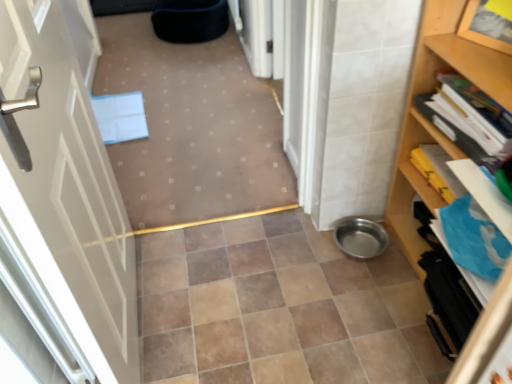
Question: Is brown ceramic tile at center wider than matte blue folder at center?

Choices:
 (A) no
 (B) yes

Answer: (B)

Question: Is matte blue folder at center surrounded by brown ceramic tile at center?

Choices:
 (A) no
 (B) yes

Answer: (A)

Question: Is brown ceramic tile at center not inside matte blue folder at center?

Choices:
 (A) yes
 (B) no

Answer: (A)

Question: Considering the relative positions of brown ceramic tile at center and matte blue folder at center in the image provided, is brown ceramic tile at center to the right of matte blue folder at center from the viewer's perspective?

Choices:
 (A) no
 (B) yes

Answer: (B)

Question: Is brown ceramic tile at center positioned far away from matte blue folder at center?

Choices:
 (A) yes
 (B) no

Answer: (B)

Question: Considering the positions of white glossy door at left and brown ceramic tile at center in the image, is white glossy door at left bigger or smaller than brown ceramic tile at center?

Choices:
 (A) small
 (B) big

Answer: (B)

Question: From a real-world perspective, is white glossy door at left positioned above or below brown ceramic tile at center?

Choices:
 (A) below
 (B) above

Answer: (B)

Question: From their relative heights in the image, would you say white glossy door at left is taller or shorter than brown ceramic tile at center?

Choices:
 (A) short
 (B) tall

Answer: (B)

Question: Is white glossy door at left spatially inside brown ceramic tile at center, or outside of it?

Choices:
 (A) inside
 (B) outside

Answer: (B)

Question: In terms of size, does matte blue folder at center appear bigger or smaller than wooden bookshelf at right?

Choices:
 (A) big
 (B) small

Answer: (B)

Question: From a real-world perspective, is matte blue folder at center above or below wooden bookshelf at right?

Choices:
 (A) above
 (B) below

Answer: (B)

Question: Relative to wooden bookshelf at right, is matte blue folder at center in front or behind?

Choices:
 (A) behind
 (B) front

Answer: (A)

Question: Is matte blue folder at center to the left or to the right of wooden bookshelf at right in the image?

Choices:
 (A) right
 (B) left

Answer: (B)

Question: In terms of height, does matte blue folder at center look taller or shorter compared to white glossy door at left?

Choices:
 (A) short
 (B) tall

Answer: (A)

Question: From the image's perspective, is matte blue folder at center above or below white glossy door at left?

Choices:
 (A) below
 (B) above

Answer: (B)